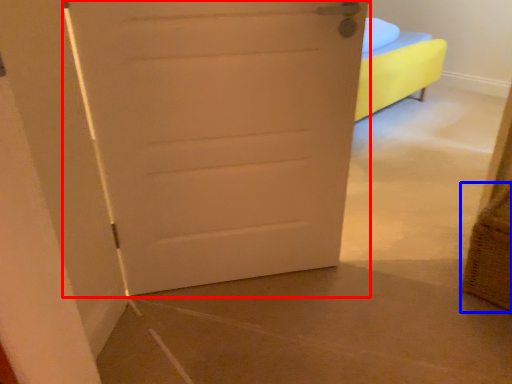
Question: Among these objects, which one is nearest to the camera, door (highlighted by a red box) or basket (highlighted by a blue box)?

Choices:
 (A) door
 (B) basket

Answer: (A)